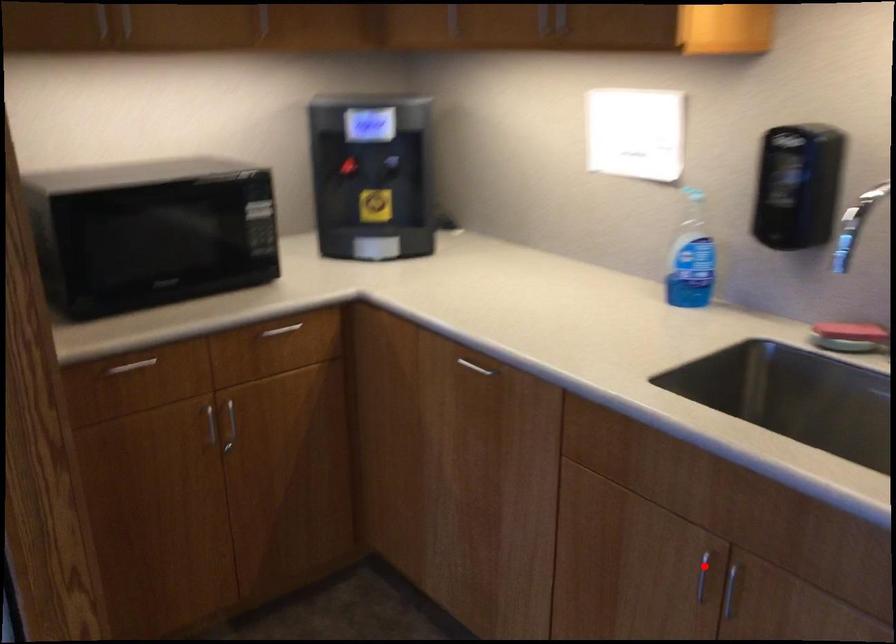
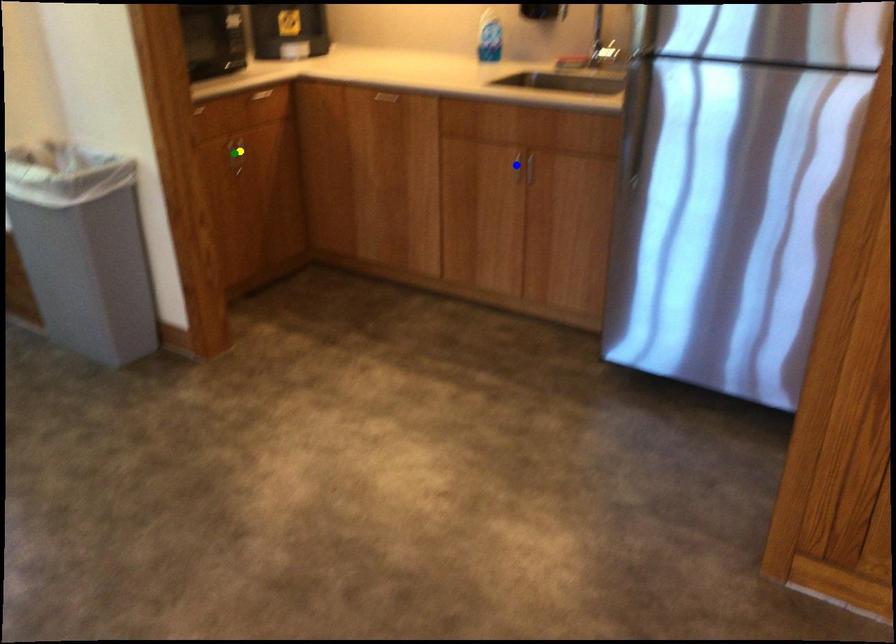
Question: I am providing you with two images of the same scene from different viewpoints. A red point is marked on the first image. You are given multiple points on the second image. Can you choose the point in image 2 that corresponds to the point in image 1?

Choices:
 (A) yellow point
 (B) green point
 (C) blue point

Answer: (C)